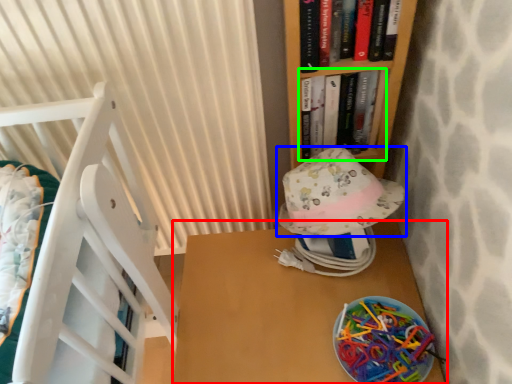
Question: Which is farther away from table (highlighted by a red box)? hat (highlighted by a blue box) or book (highlighted by a green box)?

Choices:
 (A) hat
 (B) book

Answer: (B)